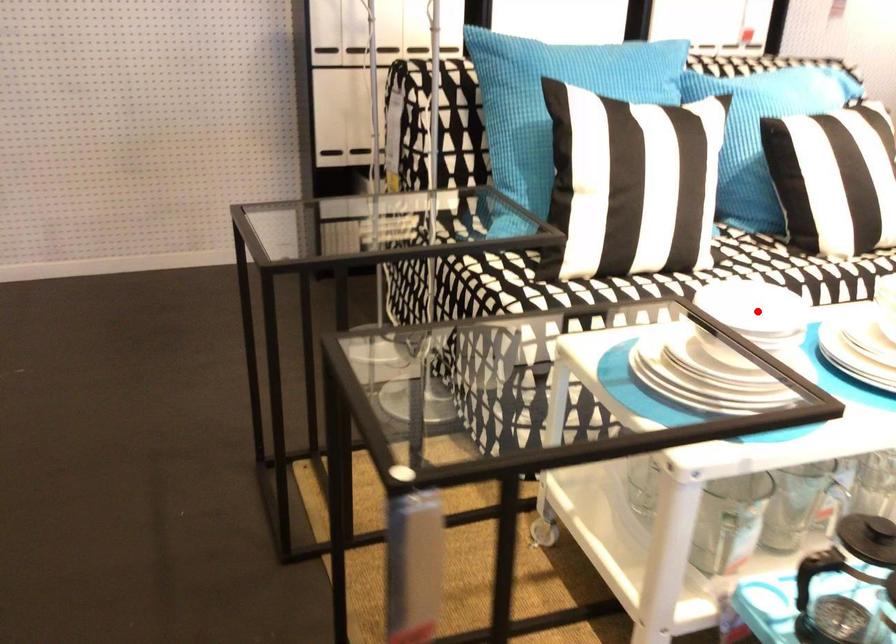
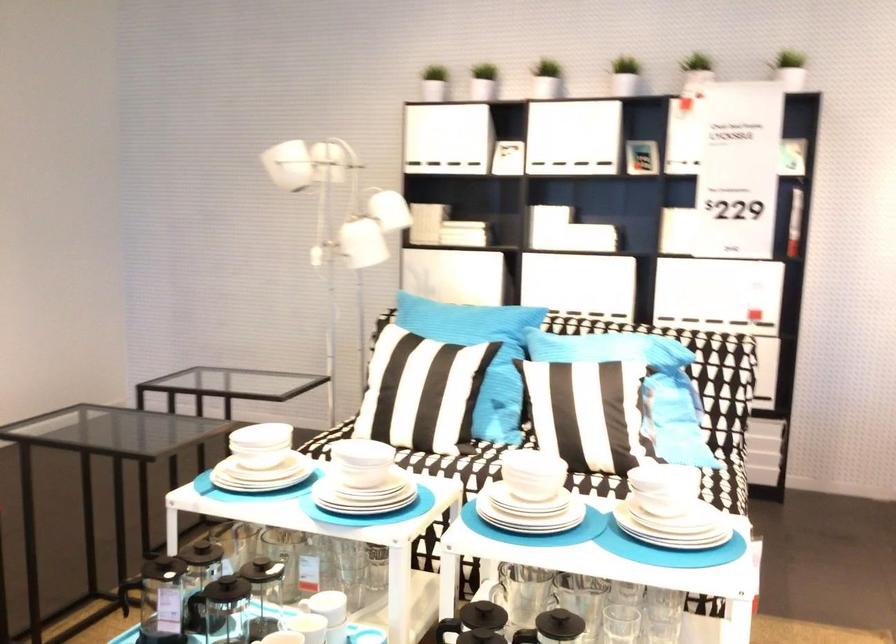
Question: I am providing you with two images of the same scene from different viewpoints. A red point is marked on the first image. Is the red point's position out of view in image 2?

Choices:
 (A) Yes
 (B) No

Answer: (A)